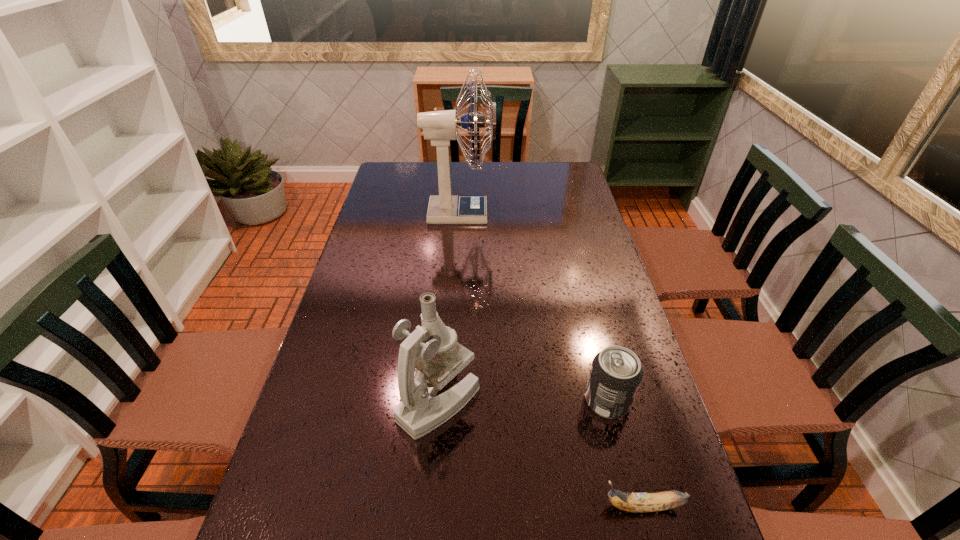
I want to click on vacant space located 0.180m at the stem of the nearest object, so click(504, 506).

Where is `vacant position located 0.250m at the stem of the nearest object`? This screenshot has height=540, width=960. vacant position located 0.250m at the stem of the nearest object is located at coordinates (466, 506).

Where is `object that is at the far edge`? This screenshot has height=540, width=960. object that is at the far edge is located at coordinates (440, 127).

The height and width of the screenshot is (540, 960). In order to click on soda can at the right edge in this screenshot , I will do `click(616, 373)`.

The image size is (960, 540). In order to click on banana positioned at the right edge in this screenshot , I will do `click(631, 502)`.

You are a GUI agent. You are given a task and a screenshot of the screen. Output one action in this format:
    pyautogui.click(x=<x>, y=<y>)
    Task: Click on the vacant space at the far edge of the desktop
    The width and height of the screenshot is (960, 540).
    Given the screenshot: What is the action you would take?
    pyautogui.click(x=471, y=182)

In the image, there is a desktop. Identify the location of vacant space at the left edge. The image size is (960, 540). (410, 208).

The height and width of the screenshot is (540, 960). Identify the location of vacant space at the right edge. (556, 245).

You are a GUI agent. You are given a task and a screenshot of the screen. Output one action in this format:
    pyautogui.click(x=<x>, y=<y>)
    Task: Click on the vacant region at the far left corner of the desktop
    
    Given the screenshot: What is the action you would take?
    pyautogui.click(x=398, y=162)

The height and width of the screenshot is (540, 960). I want to click on vacant space at the far right corner of the desktop, so click(565, 168).